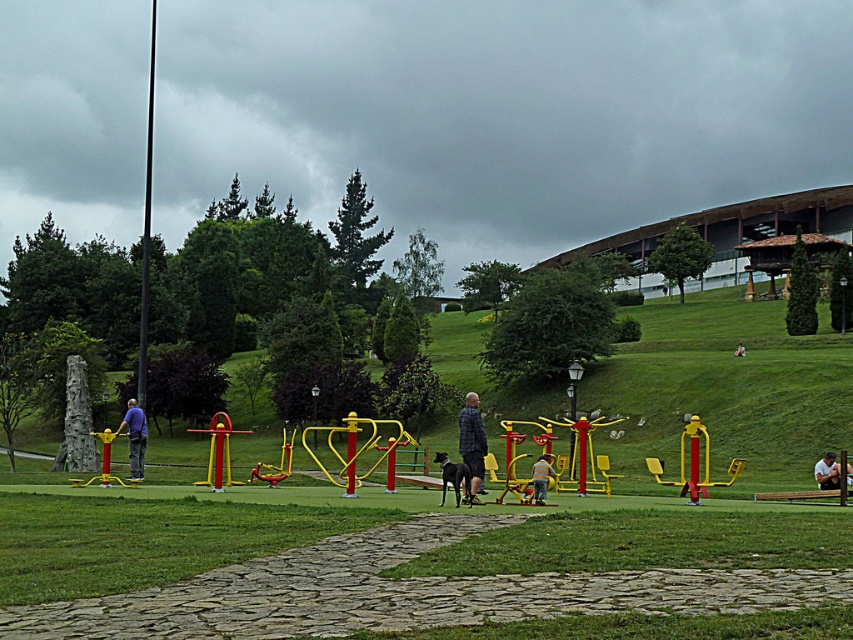
You are standing at the entrance of the park and see the plaid fabric jacket at center and the matte yellow exercise machine at center. Which object is nearer to you?

The plaid fabric jacket at center is closer to the viewer than the matte yellow exercise machine at center, so the plaid fabric jacket at center is nearer to you.

You are a photographer standing at the entrance of the park and want to take a photo of both the matte blue shirt at center and the white fabric shirt at center. Based on their positions, which one will appear closer to you in the photo?

The matte blue shirt at center will appear closer to you in the photo because it is positioned further to the viewer than the white fabric shirt at center.

You are a photographer taking a picture of the plaid fabric jacket at center and the white fabric shirt at center. Which one should you focus on first if you want to capture both clearly in the same frame?

The plaid fabric jacket at center is above the white fabric shirt at center, so you should focus on the plaid fabric jacket at center first to ensure both are in focus.